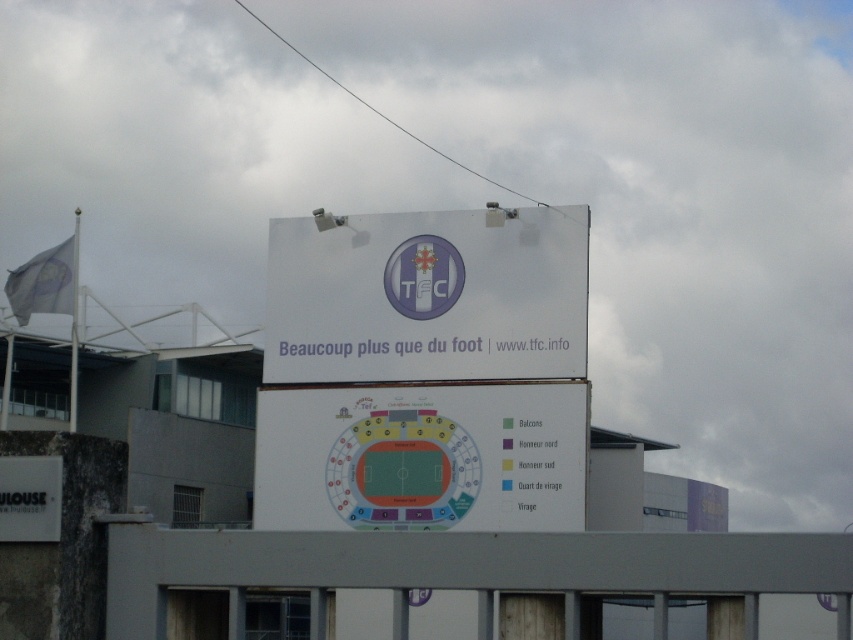
Does point (434, 272) come in front of point (45, 456)?

No, (434, 272) is further to viewer.

Can you confirm if white paper sign at center is positioned to the right of white matte sign at lower left?

Yes, white paper sign at center is to the right of white matte sign at lower left.

Between point (271, 371) and point (10, 540), which one is positioned behind?

Point (271, 371)

Identify the location of white paper sign at center. The height and width of the screenshot is (640, 853). (427, 296).

Is point (373, 449) behind point (38, 512)?

Yes, it is behind point (38, 512).

Is white paper at center wider than white matte sign at lower left?

Yes.

Who is more distant from viewer, (294, 506) or (1, 515)?

The point (294, 506) is more distant.

The width and height of the screenshot is (853, 640). I want to click on white paper at center, so click(x=422, y=458).

Is white paper sign at center smaller than white paper at center?

Incorrect, white paper sign at center is not smaller in size than white paper at center.

The height and width of the screenshot is (640, 853). What do you see at coordinates (427, 296) in the screenshot? I see `white paper sign at center` at bounding box center [427, 296].

Where is `white paper sign at center`? Image resolution: width=853 pixels, height=640 pixels. white paper sign at center is located at coordinates (427, 296).